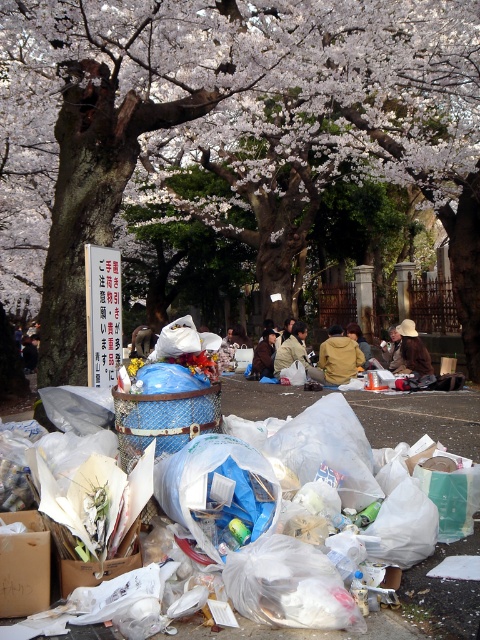
Question: In this image, where is smooth bark tree at center located relative to brown fuzzy jacket at center?

Choices:
 (A) above
 (B) below

Answer: (A)

Question: Does white plastic bags at lower center have a larger size compared to brown fabric bag at center?

Choices:
 (A) no
 (B) yes

Answer: (A)

Question: Which point is farther to the camera?

Choices:
 (A) brown fuzzy jacket at center
 (B) white plastic bags at lower center
 (C) smooth bark tree at center
 (D) brown woven hat at center

Answer: (A)

Question: Considering the relative positions of brown fabric bag at center and brown fabric jacket at center in the image provided, where is brown fabric bag at center located with respect to brown fabric jacket at center?

Choices:
 (A) left
 (B) right

Answer: (B)

Question: Which object appears farthest from the camera in this image?

Choices:
 (A) white plastic bags at lower center
 (B) smooth bark tree at center
 (C) brown fabric jacket at center

Answer: (C)

Question: Which point is farther to the camera?

Choices:
 (A) (247, 381)
 (B) (303, 356)
 (C) (331, 340)
 (D) (257, 353)

Answer: (D)